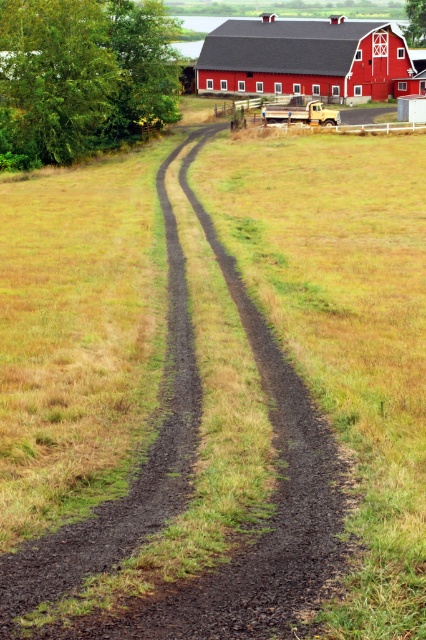
Is the position of dark brown gravel at center more distant than that of red wooden barn at upper center?

No, it is in front of red wooden barn at upper center.

Is dark brown gravel at center wider than red wooden barn at upper center?

No.

Between point (293, 547) and point (365, 68), which one is positioned in front?

Point (293, 547)

I want to click on dark brown gravel at center, so click(187, 490).